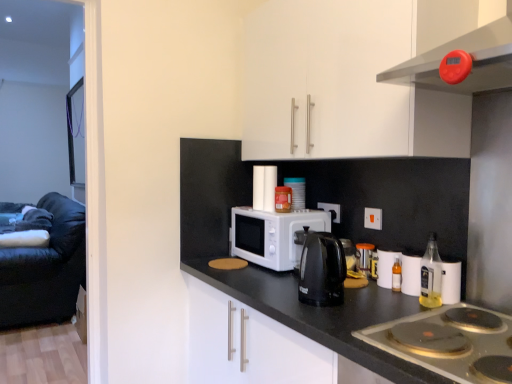
At what (x,y) coordinates should I click in order to perform the action: click on vacant area that is situated to the right of black plastic kettle at center. Please return your answer as a coordinate pair (x, y). The width and height of the screenshot is (512, 384). Looking at the image, I should click on (381, 301).